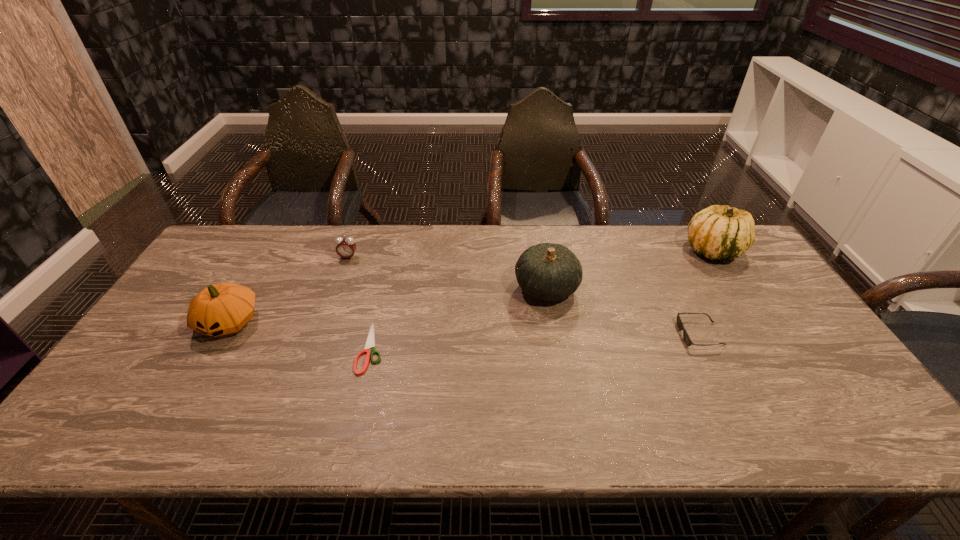
Find the location of a particular element. This screenshot has height=540, width=960. object that is at the far right corner is located at coordinates (718, 232).

Find the location of a particular element. This screenshot has height=540, width=960. free space at the far edge of the desktop is located at coordinates (430, 244).

Identify the location of vacant area at the near edge of the desktop. (335, 430).

In the image, there is a desktop. At what (x,y) coordinates should I click in order to perform the action: click on free space at the left edge. Please return your answer as a coordinate pair (x, y). This screenshot has width=960, height=540. Looking at the image, I should click on (156, 328).

Identify the location of vacant space at the far left corner of the desktop. [249, 228].

The image size is (960, 540). In order to click on free space between the fourth object from right to left and the second object from left to right in this screenshot , I will do `click(360, 303)`.

Identify the location of vacant area that lies between the third object from left to right and the second object from right to left. (536, 341).

In order to click on vacant space that's between the third object from left to right and the alarm clock in this screenshot , I will do `click(360, 303)`.

You are a GUI agent. You are given a task and a screenshot of the screen. Output one action in this format:
    pyautogui.click(x=<x>, y=<y>)
    Task: Click on the free space that is in between the leftmost gourd and the shortest object
    
    Given the screenshot: What is the action you would take?
    pyautogui.click(x=300, y=335)

The image size is (960, 540). In order to click on unoccupied position between the leftmost object and the fifth object from right to left in this screenshot , I will do `click(289, 290)`.